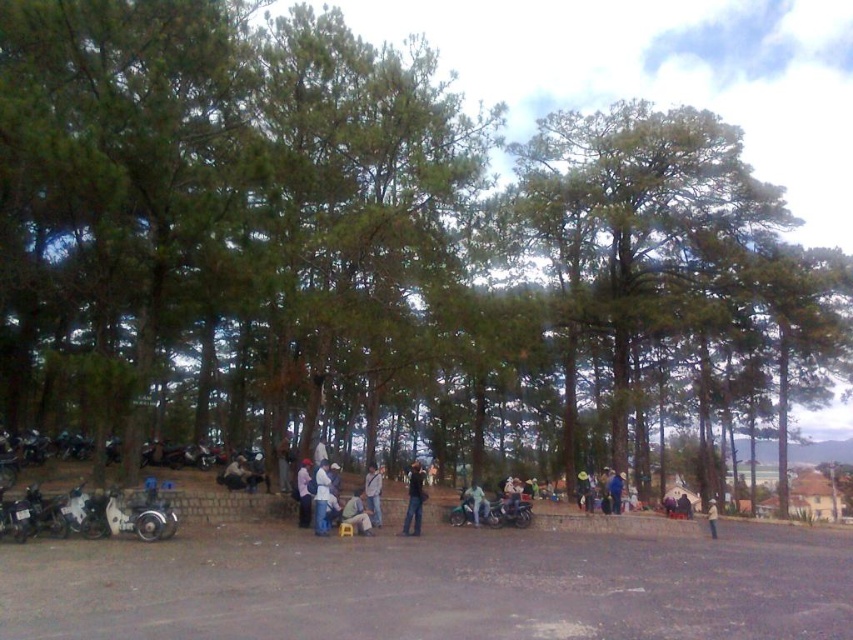
You are standing in the park scene and want to locate the white cotton shirt at center and the dark blue jeans at center. According to the description, which one is positioned to the right of the other?

The white cotton shirt at center is to the right of dark blue jeans at center.

You are a pedestrian standing at the edge of the paved area in the park scene. You want to walk from the white matte motorcycle at lower left to the light brown fabric bag at center. Can you walk directly between them without going around?

The white matte motorcycle at lower left is in front of the light brown fabric bag at center, so you cannot walk directly between them without going around the white matte motorcycle at lower left.

You are a photographer standing in the park and want to take a photo of the white cotton shirt at center and the dark blue jeans at center. Which one should you focus on first to ensure both are in focus?

The white cotton shirt at center is closer to the viewer than dark blue jeans at center, so you should focus on the white cotton shirt at center first to ensure both are in focus.